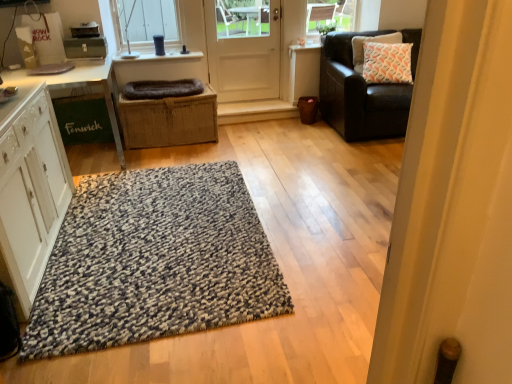
Where is `vacant region above speckled wool rug at center (from a real-world perspective)`? The height and width of the screenshot is (384, 512). vacant region above speckled wool rug at center (from a real-world perspective) is located at coordinates (151, 229).